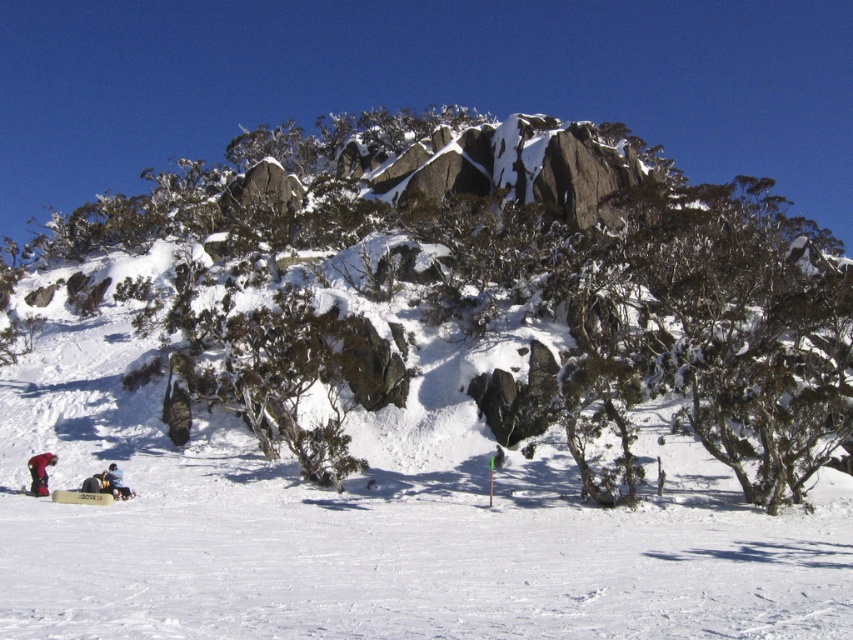
You are planning to place a small picnic basket between the green leafy shrub at center and the white snowboarder at lower left. Based on their sizes, will the basket fit comfortably between them?

The green leafy shrub at center might be wider than white snowboarder at lower left, so the picnic basket may not fit comfortably between them due to the shrub potentially taking up more space.

You are a hiker trying to navigate to a green leafy shrub at center. Given that you are currently standing at the point marked as point [480,296], can you reach the shrub without moving?

Yes, you are already at the location of the green leafy shrub at center since the shrub is located at point [480,296].

You are planning to take a photo of the green leafy shrub at center and the red fabric jacket at lower left. Which object should you focus on first if you want to capture both in the same frame without moving the camera?

The green leafy shrub at center is bigger than the red fabric jacket at lower left, so you should focus on the green leafy shrub at center first to ensure it fills the frame appropriately before adjusting for the smaller red fabric jacket at lower left.